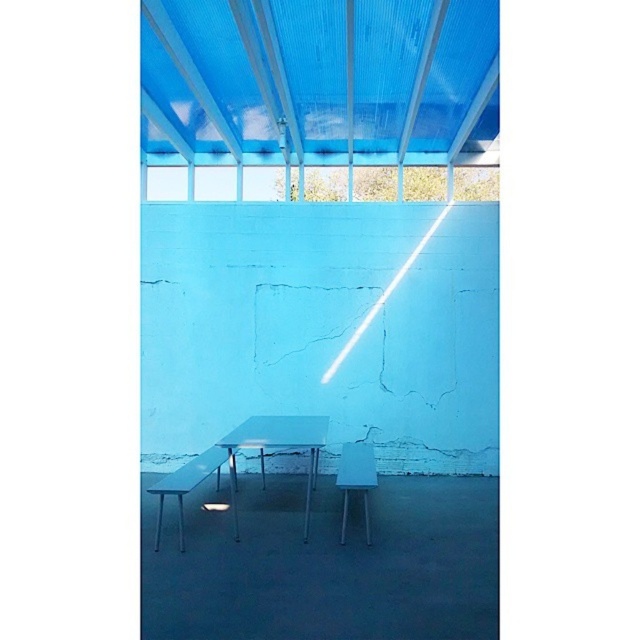
Question: Does metallic silver table at center lie in front of matte blue plastic chair at center?

Choices:
 (A) yes
 (B) no

Answer: (A)

Question: Observing the image, what is the correct spatial positioning of metallic silver table at center in reference to matte blue plastic chair at center?

Choices:
 (A) right
 (B) left

Answer: (B)

Question: Is metallic silver table at center to the right of matte blue plastic chair at center from the viewer's perspective?

Choices:
 (A) yes
 (B) no

Answer: (B)

Question: Which point is farther from the camera taking this photo?

Choices:
 (A) (365, 520)
 (B) (236, 525)

Answer: (B)

Question: Which point is farther to the camera?

Choices:
 (A) matte blue plastic chair at center
 (B) metallic silver table at center

Answer: (A)